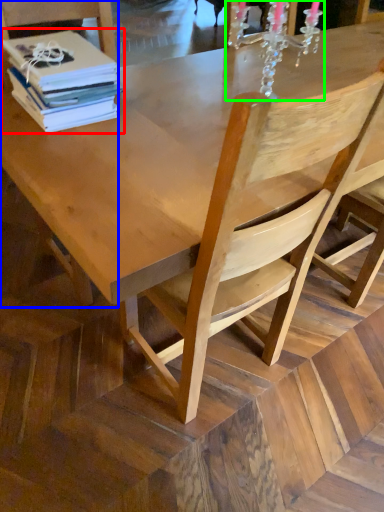
Question: Which object is positioned closest to book (highlighted by a red box)? Select from chair (highlighted by a blue box) and candle holder (highlighted by a green box).

Choices:
 (A) chair
 (B) candle holder

Answer: (A)